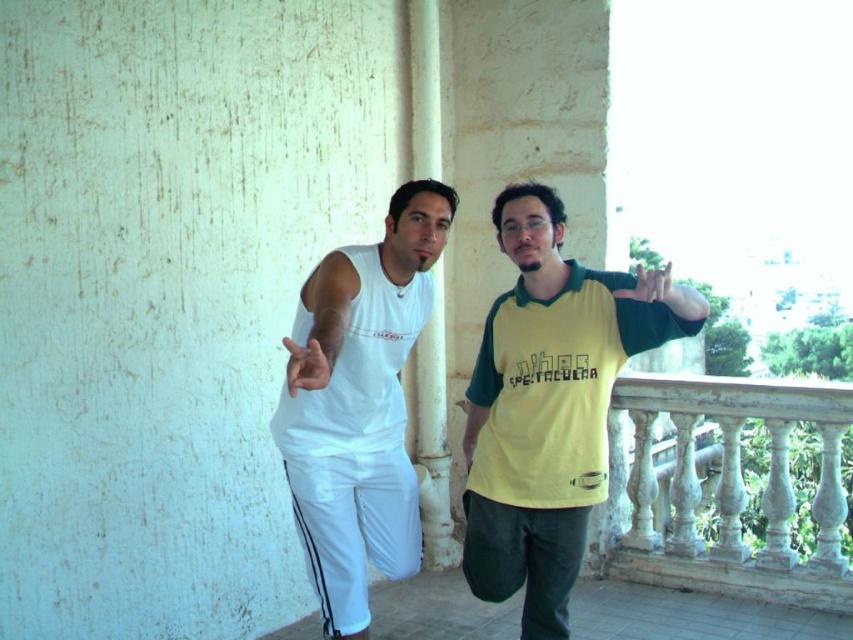
Question: Which point appears closest to the camera in this image?

Choices:
 (A) (694, 422)
 (B) (328, 570)
 (C) (543, 364)
 (D) (292, 392)

Answer: (D)

Question: Is white matte tank top at center in front of yellow-green fabric hand at upper right?

Choices:
 (A) yes
 (B) no

Answer: (B)

Question: Which object appears farthest from the camera in this image?

Choices:
 (A) white stone balustrade at lower right
 (B) yellow-green fabric hand at upper right
 (C) matte white hand at center

Answer: (A)

Question: Is matte white hand at center positioned behind yellow-green fabric hand at upper right?

Choices:
 (A) yes
 (B) no

Answer: (B)

Question: Which is nearer to the matte white hand at center?

Choices:
 (A) yellow-green fabric hand at upper right
 (B) white matte tank top at center

Answer: (B)

Question: Where is yellow-green jersey at right located in relation to yellow-green fabric hand at upper right in the image?

Choices:
 (A) above
 (B) below

Answer: (B)